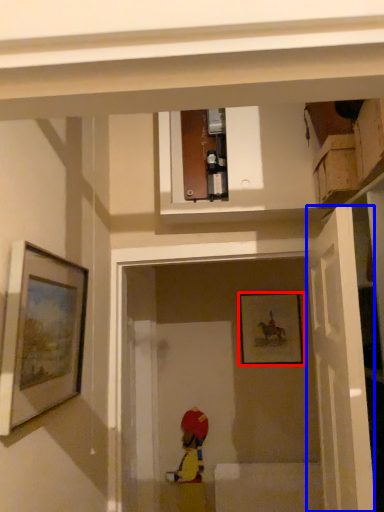
Question: Which point is further to the camera, picture frame (highlighted by a red box) or door (highlighted by a blue box)?

Choices:
 (A) picture frame
 (B) door

Answer: (A)